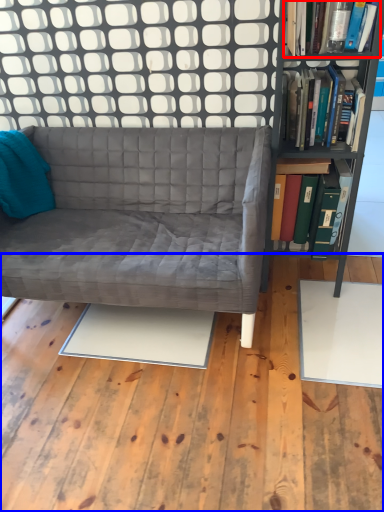
Question: Among these objects, which one is farthest to the camera, book (highlighted by a red box) or plywood (highlighted by a blue box)?

Choices:
 (A) book
 (B) plywood

Answer: (A)